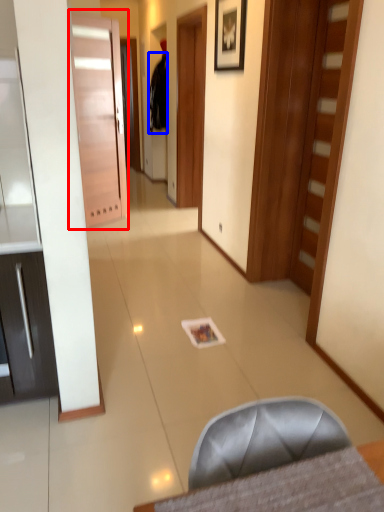
Question: Which of the following is the closest to the observer, door (highlighted by a red box) or robe (highlighted by a blue box)?

Choices:
 (A) door
 (B) robe

Answer: (A)